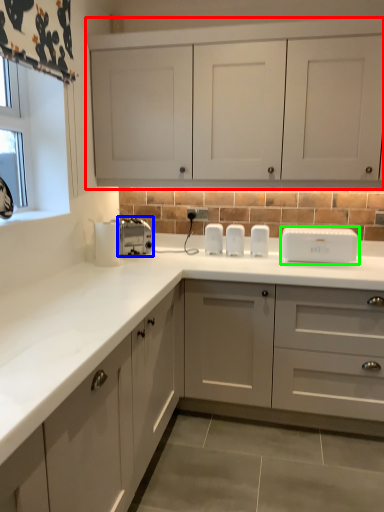
Question: Which object is the farthest from cabinetry (highlighted by a red box)? Choose among these: toaster (highlighted by a blue box) or home appliance (highlighted by a green box).

Choices:
 (A) toaster
 (B) home appliance

Answer: (A)